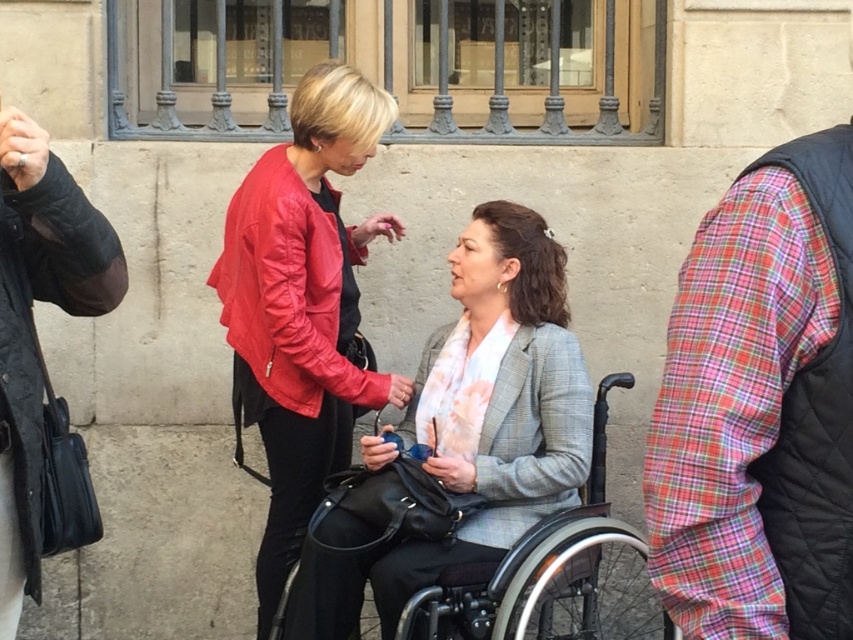
Question: Which object appears farthest from the camera in this image?

Choices:
 (A) plaid fabric sleeve at right
 (B) black quilted jacket at left
 (C) matte red leather jacket at center
 (D) black plastic wheelchair at center

Answer: (C)

Question: Does black quilted jacket at left appear under black plastic wheelchair at center?

Choices:
 (A) no
 (B) yes

Answer: (A)

Question: Considering the real-world distances, which object is farthest from the black plastic wheelchair at center?

Choices:
 (A) plaid fabric sleeve at right
 (B) matte red leather jacket at center
 (C) black quilted jacket at left

Answer: (A)

Question: Is plaid fabric sleeve at right further to the viewer compared to black quilted jacket at left?

Choices:
 (A) no
 (B) yes

Answer: (A)

Question: Which point is closer to the camera?

Choices:
 (A) (592, 586)
 (B) (769, 512)
 (C) (73, 296)

Answer: (B)

Question: Can you confirm if black quilted jacket at left is positioned below black plastic wheelchair at center?

Choices:
 (A) no
 (B) yes

Answer: (A)